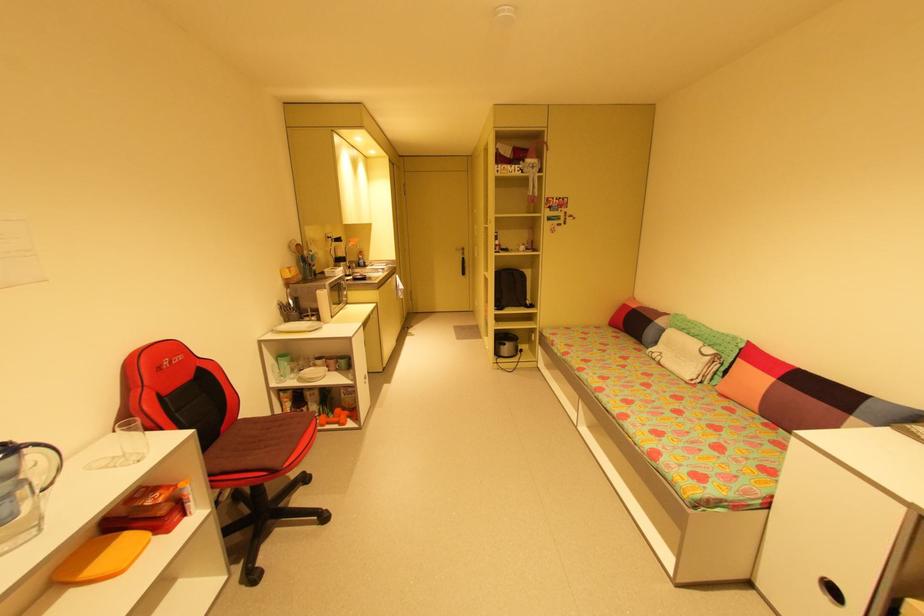
Where is `sofa sitting surface`? The height and width of the screenshot is (616, 924). sofa sitting surface is located at coordinates (676, 422).